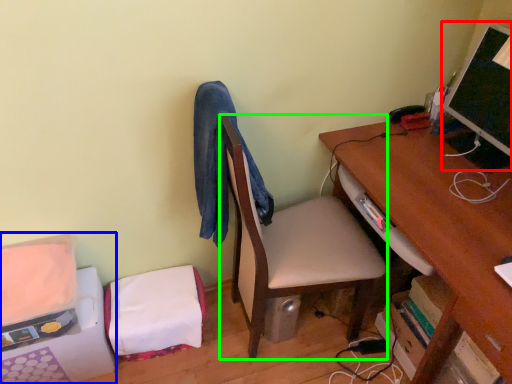
Question: Considering the real-world distances, which object is farthest from computer monitor (highlighted by a red box)? furniture (highlighted by a blue box) or table (highlighted by a green box)?

Choices:
 (A) furniture
 (B) table

Answer: (A)